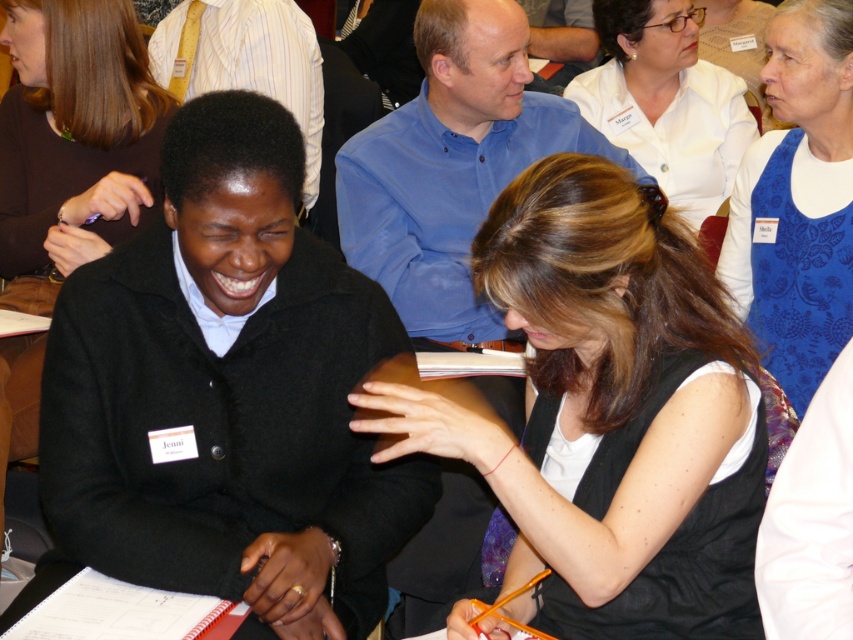
Question: Does blue paisley scarf at upper right have a greater width compared to white matte shirt at upper center?

Choices:
 (A) no
 (B) yes

Answer: (A)

Question: Is matte black jacket at left positioned at the back of blue paisley scarf at upper right?

Choices:
 (A) yes
 (B) no

Answer: (A)

Question: Which of the following is the closest to the observer?

Choices:
 (A) (45, 193)
 (B) (751, 600)
 (C) (642, 84)
 (D) (833, 44)

Answer: (B)

Question: Can you confirm if blue paisley scarf at upper right is thinner than white matte shirt at upper center?

Choices:
 (A) yes
 (B) no

Answer: (A)

Question: Which object is farther from the camera taking this photo?

Choices:
 (A) blue paisley scarf at upper right
 (B) white matte shirt at upper center

Answer: (B)

Question: Estimate the real-world distances between objects in this image. Which object is closer to the white matte shirt at upper center?

Choices:
 (A) matte black jacket at left
 (B) blue paisley scarf at upper right

Answer: (B)